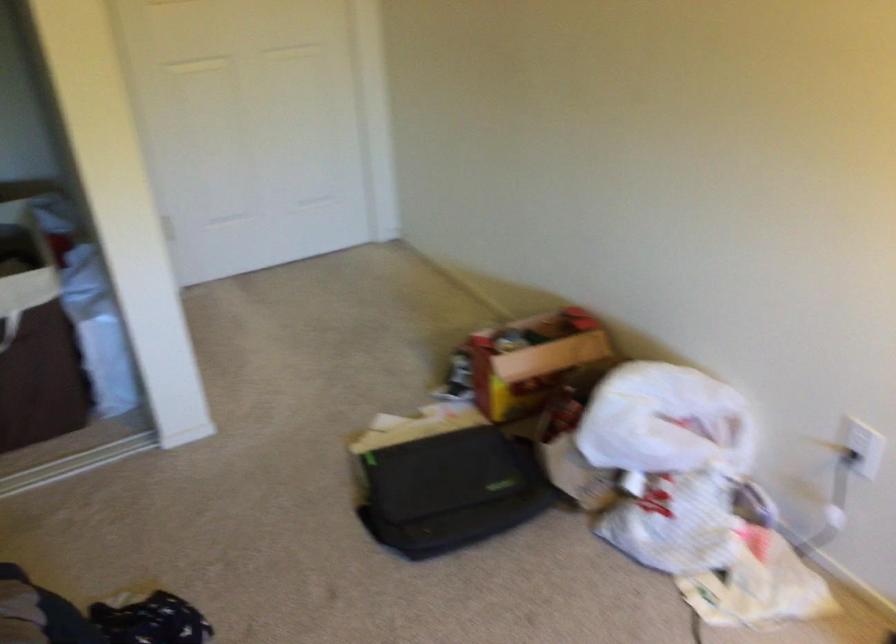
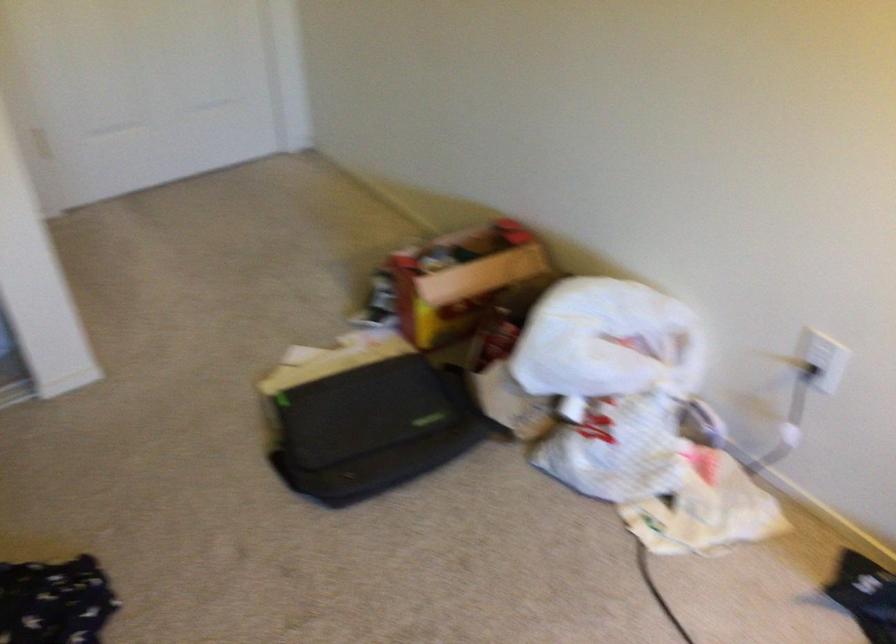
Question: The images are taken continuously from a first-person perspective. In which direction is your viewpoint rotating?

Choices:
 (A) Left
 (B) Right
 (C) Up
 (D) Down

Answer: (D)